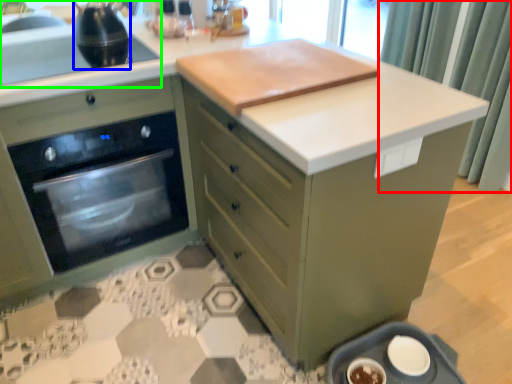
Question: Which object is the closest to the curtain (highlighted by a red box)? Choose among these: kitchen appliance (highlighted by a blue box) or sink (highlighted by a green box).

Choices:
 (A) kitchen appliance
 (B) sink

Answer: (A)